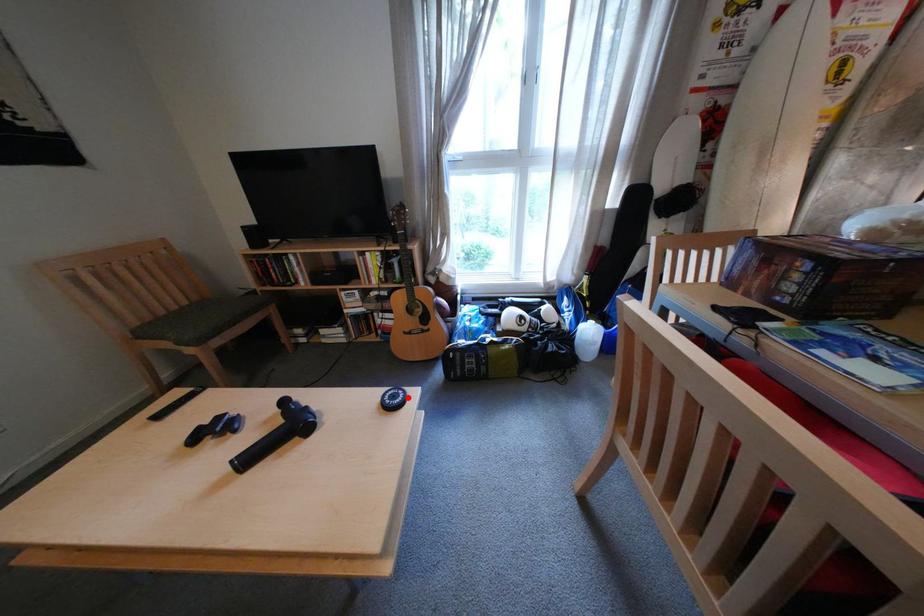
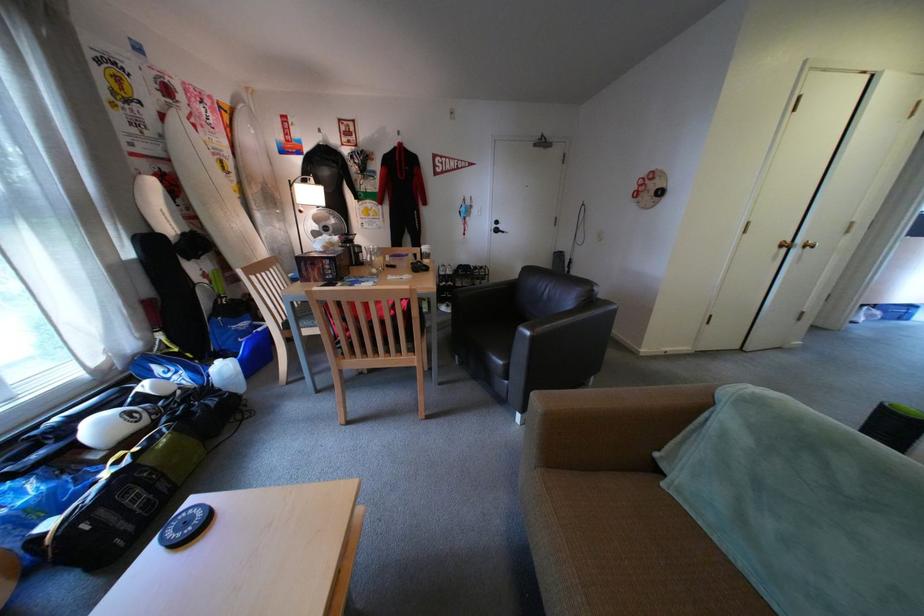
In the second image, find the point that corresponds to the highlighted location in the first image.

(199, 525)